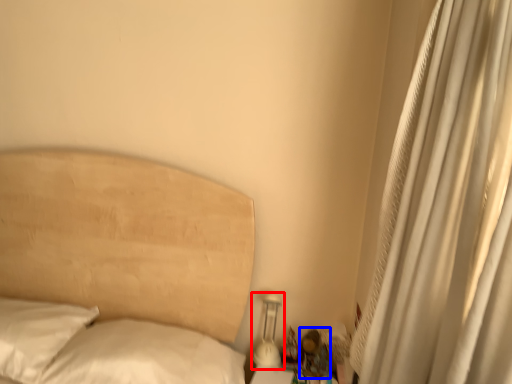
Question: Which object is further to the camera taking this photo, bedside lamp (highlighted by a red box) or miniature (highlighted by a blue box)?

Choices:
 (A) bedside lamp
 (B) miniature

Answer: (A)